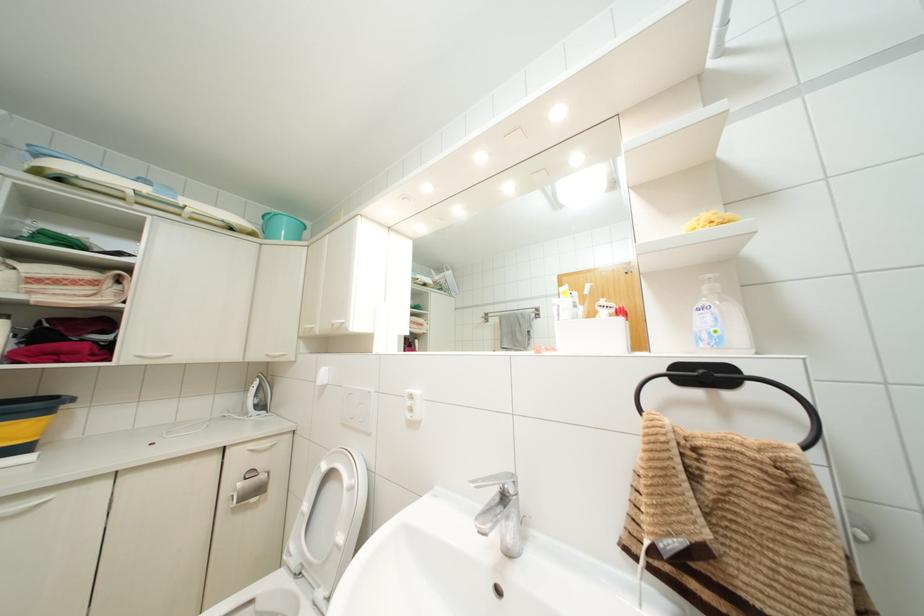
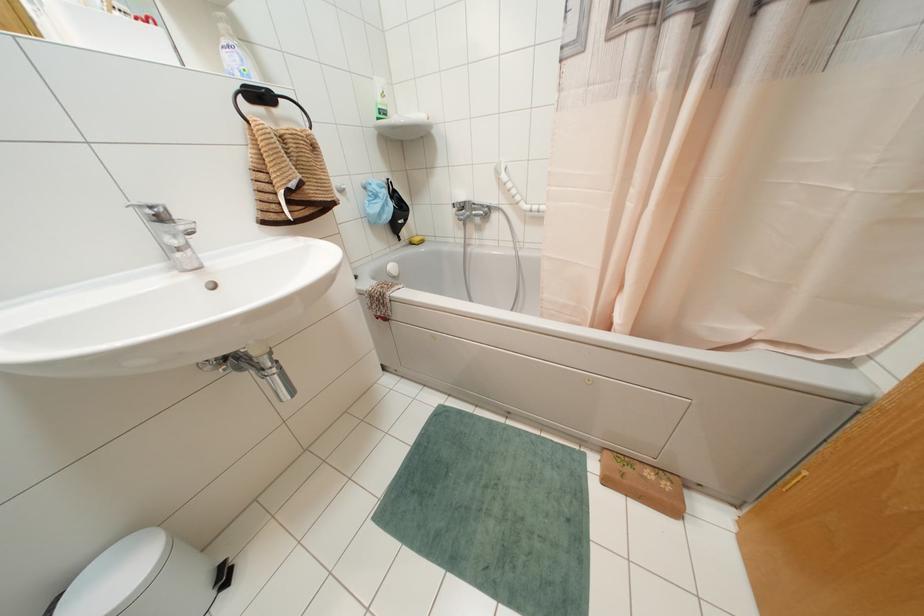
Based on the continuous images, in which direction is the camera rotating?

The camera rotated toward right-down.